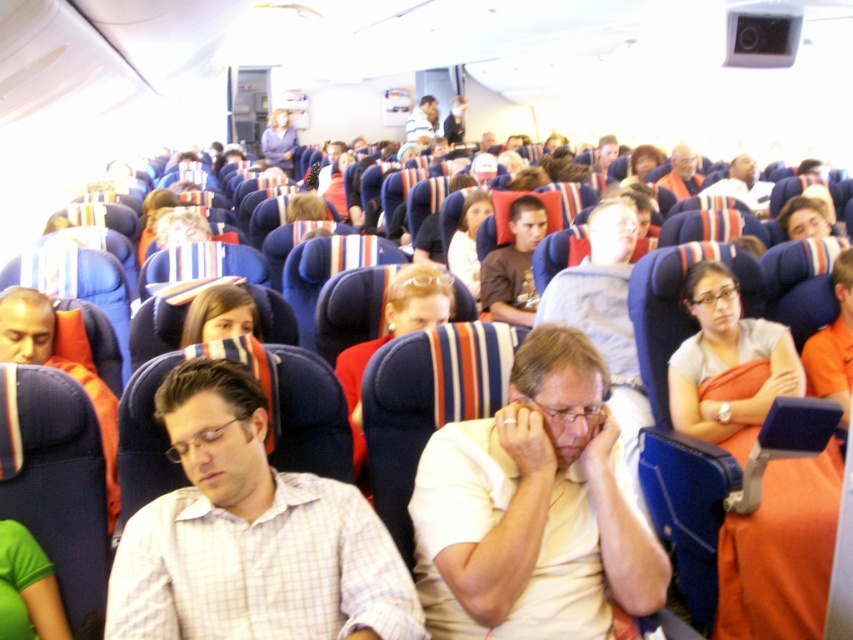
Between point (340, 580) and point (107, 426), which one is positioned behind?

Positioned behind is point (107, 426).

Which of these two, light blue plaid shirt at center or matte orange pillow at left, stands taller?

With more height is matte orange pillow at left.

Is point (218, 557) closer to camera compared to point (0, 356)?

That is True.

Where is `light blue plaid shirt at center`? The image size is (853, 640). light blue plaid shirt at center is located at coordinates (250, 534).

Is white matte shirt at center positioned behind light blue plaid shirt at center?

Yes, it is behind light blue plaid shirt at center.

Which of these two, white matte shirt at center or light blue plaid shirt at center, stands shorter?

light blue plaid shirt at center is shorter.

Who is more forward, (465, 440) or (393, 596)?

Positioned in front is point (393, 596).

Image resolution: width=853 pixels, height=640 pixels. Find the location of `white matte shirt at center`. white matte shirt at center is located at coordinates (532, 508).

Who is shorter, matte orange shirt at upper right or striped shirt at center?

matte orange shirt at upper right

Does point (695, 182) come in front of point (428, 125)?

Yes, it is in front of point (428, 125).

Is point (671, 170) positioned after point (419, 109)?

No, it is not.

In order to click on matte orange shirt at upper right in this screenshot , I will do (x=682, y=172).